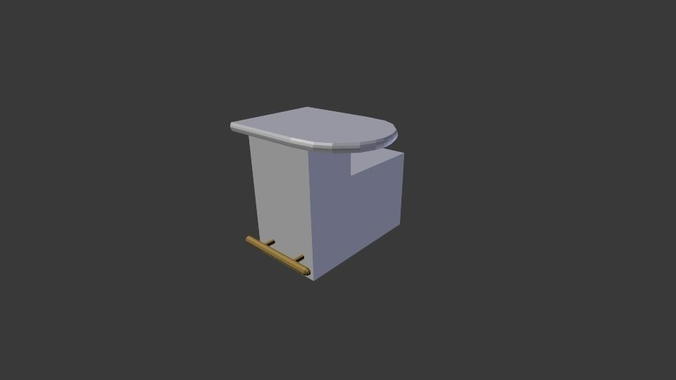
Identify the location of bar. The image size is (676, 380). (297, 256).